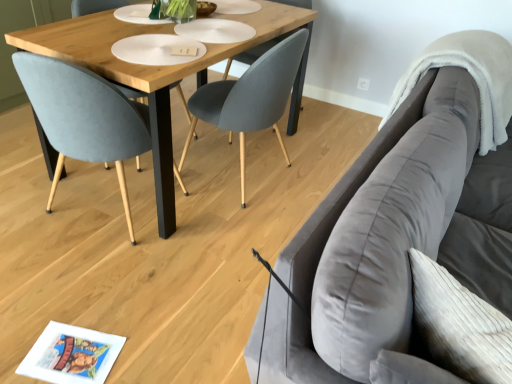
Question: Is matte gray chair at center, the 1th chair in the right-to-left sequence, touching wooden table at center?

Choices:
 (A) no
 (B) yes

Answer: (A)

Question: From the image's perspective, is matte gray chair at center, which appears as the second chair when viewed from the left, located beneath wooden table at center?

Choices:
 (A) no
 (B) yes

Answer: (B)

Question: Is matte gray chair at center, which appears as the second chair when viewed from the left, at the right side of wooden table at center?

Choices:
 (A) no
 (B) yes

Answer: (B)

Question: From a real-world perspective, is matte gray chair at center, which appears as the second chair when viewed from the left, on wooden table at center?

Choices:
 (A) no
 (B) yes

Answer: (B)

Question: Can you confirm if matte gray chair at center, which appears as the second chair when viewed from the left, is smaller than wooden table at center?

Choices:
 (A) no
 (B) yes

Answer: (B)

Question: Could you tell me if matte gray chair at center, the 1th chair in the right-to-left sequence, is turned towards wooden table at center?

Choices:
 (A) yes
 (B) no

Answer: (A)

Question: From the image's perspective, is velvet blue chair at center, which appears as the 1th chair when viewed from the left, below wooden table at center?

Choices:
 (A) yes
 (B) no

Answer: (A)

Question: Would you say velvet blue chair at center, which appears as the 1th chair when viewed from the left, is outside wooden table at center?

Choices:
 (A) no
 (B) yes

Answer: (A)

Question: Could you tell me if velvet blue chair at center, which appears as the 1th chair when viewed from the left, is facing wooden table at center?

Choices:
 (A) no
 (B) yes

Answer: (B)

Question: Does velvet blue chair at center, which appears as the 1th chair when viewed from the left, have a smaller size compared to wooden table at center?

Choices:
 (A) no
 (B) yes

Answer: (B)

Question: Is velvet blue chair at center, which is counted as the 2th chair, starting from the right, next to wooden table at center and touching it?

Choices:
 (A) yes
 (B) no

Answer: (B)

Question: Is velvet blue chair at center, which appears as the 1th chair when viewed from the left, bigger than wooden table at center?

Choices:
 (A) no
 (B) yes

Answer: (A)

Question: Is wooden table at center oriented away from matte gray chair at center, the 1th chair in the right-to-left sequence?

Choices:
 (A) yes
 (B) no

Answer: (A)